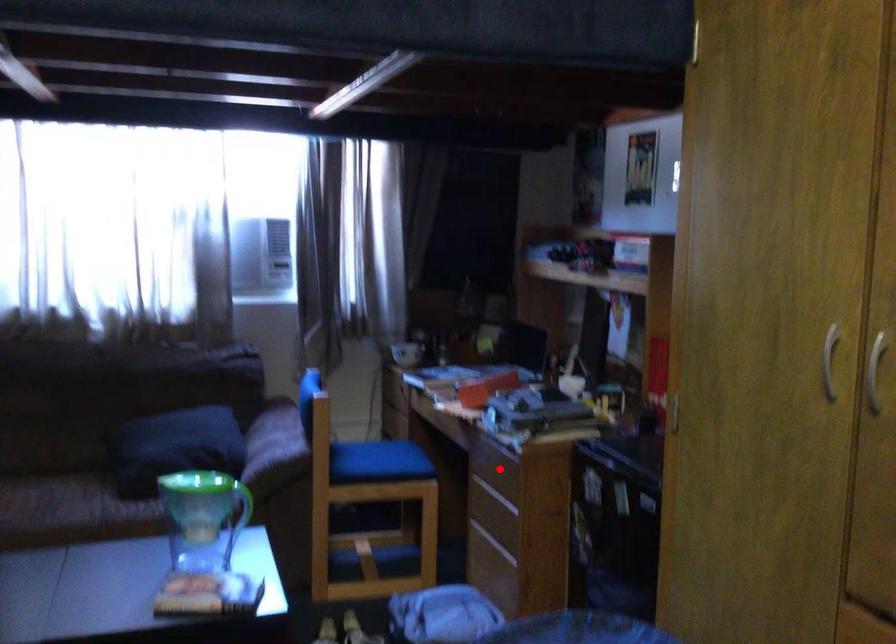
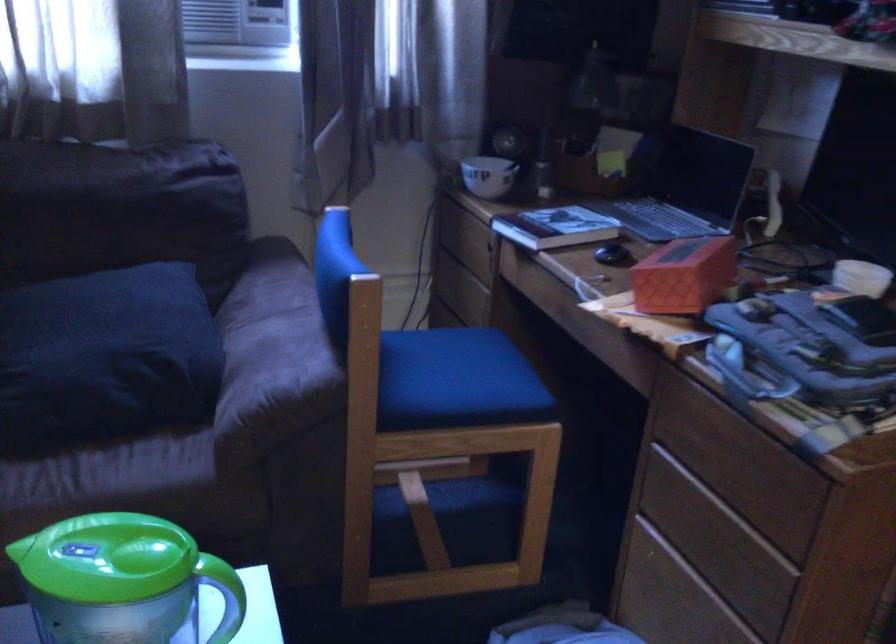
The point at the highlighted location is marked in the first image. Where is the corresponding point in the second image?

(739, 462)